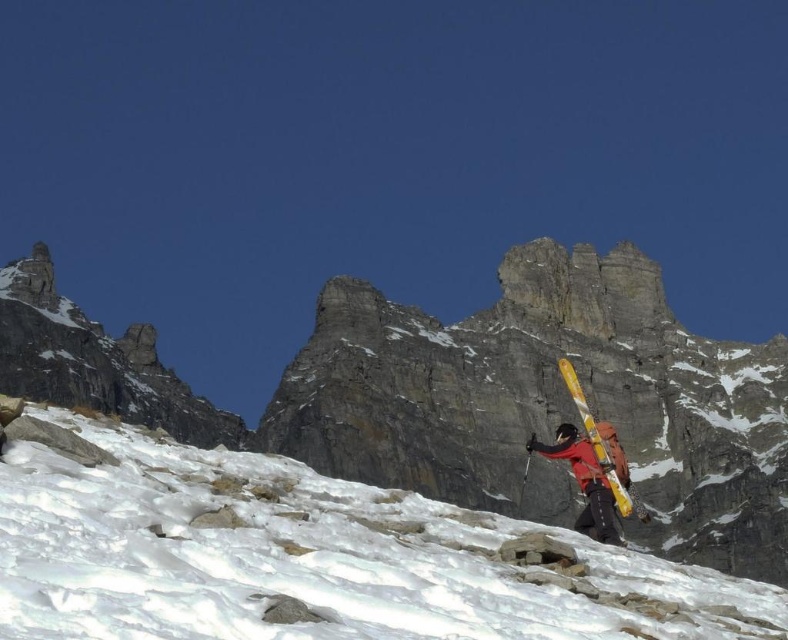
Question: Is white powdery snow at lower right above yellow metallic skis at center?

Choices:
 (A) yes
 (B) no

Answer: (A)

Question: Which of the following is the closest to the observer?

Choices:
 (A) white powdery snow at lower right
 (B) yellow metallic skis at center

Answer: (A)

Question: Can you confirm if white powdery snow at lower right is positioned to the right of yellow metallic skis at center?

Choices:
 (A) yes
 (B) no

Answer: (B)

Question: Does gray rocky mountain at center come behind yellow metallic skis at center?

Choices:
 (A) no
 (B) yes

Answer: (B)

Question: Which is nearer to the white powdery snow at lower right?

Choices:
 (A) gray rocky mountain at center
 (B) yellow metallic skis at center

Answer: (B)

Question: Which object is farther from the camera taking this photo?

Choices:
 (A) gray rocky mountain at center
 (B) white powdery snow at lower right

Answer: (A)